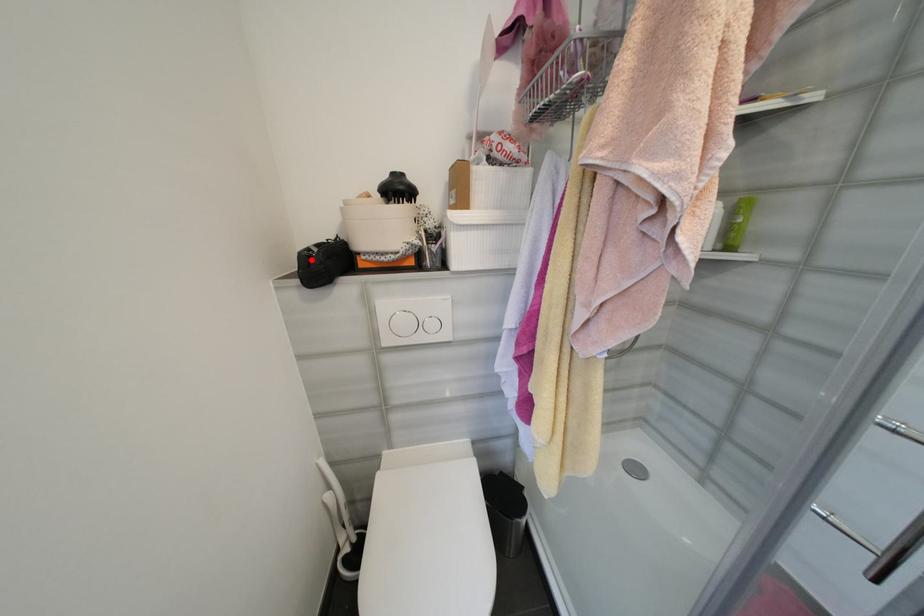
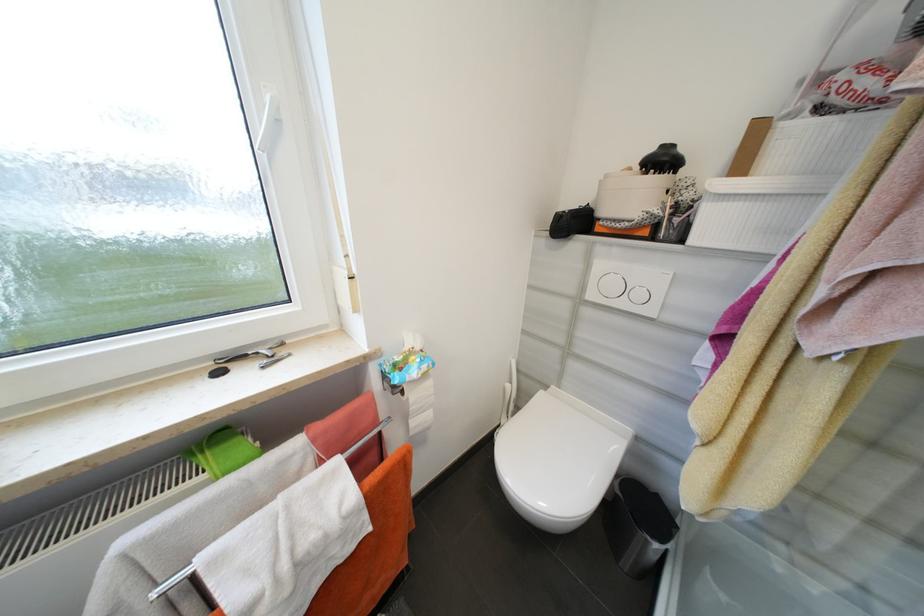
Where in the second image is the point corresponding to the highlighted location from the first image?

(565, 217)